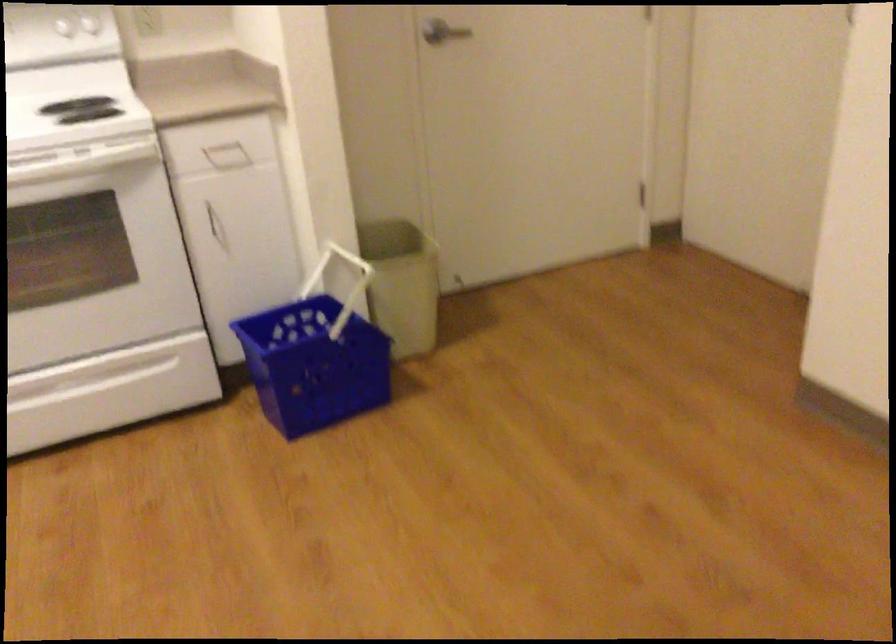
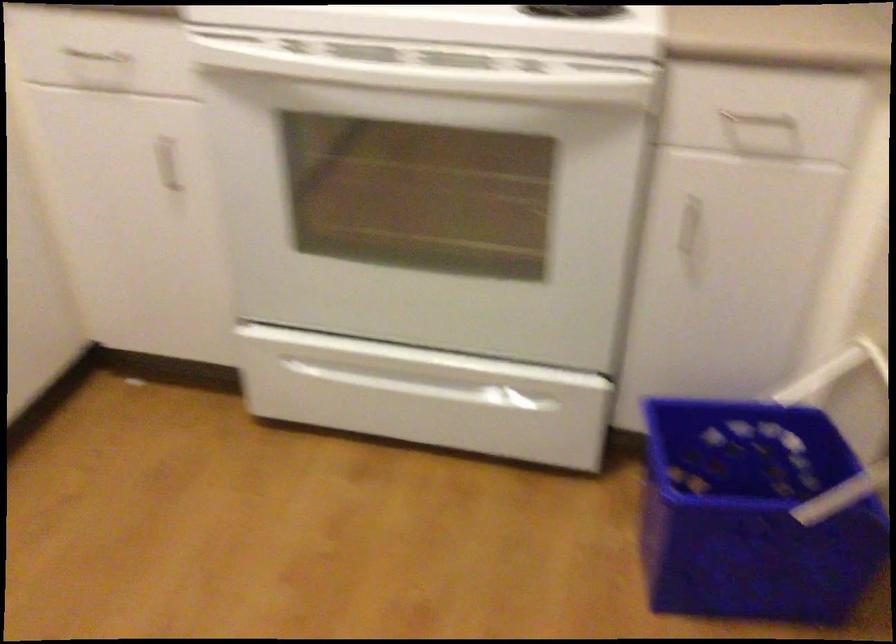
Where in the second image is the point corresponding to pixel 95 379 from the first image?

(435, 379)